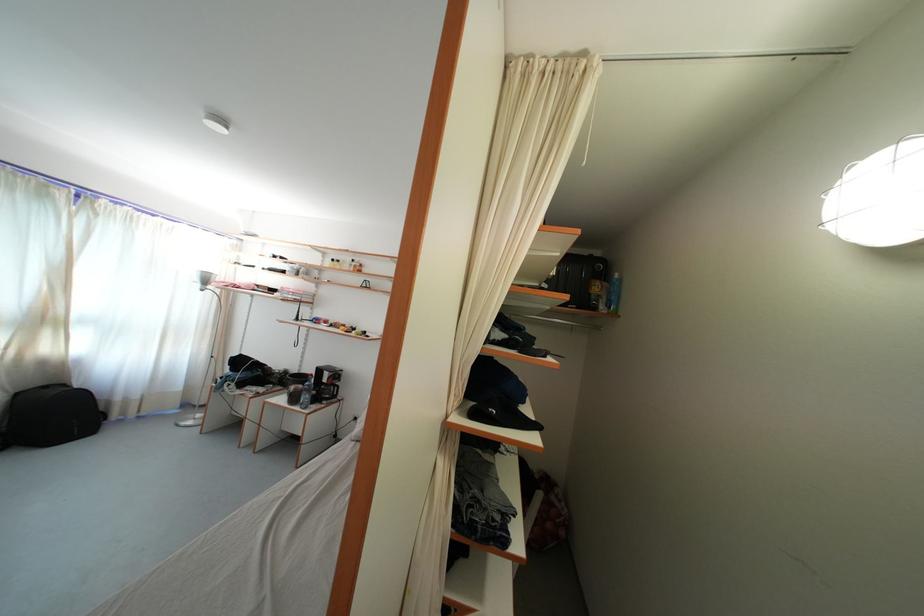
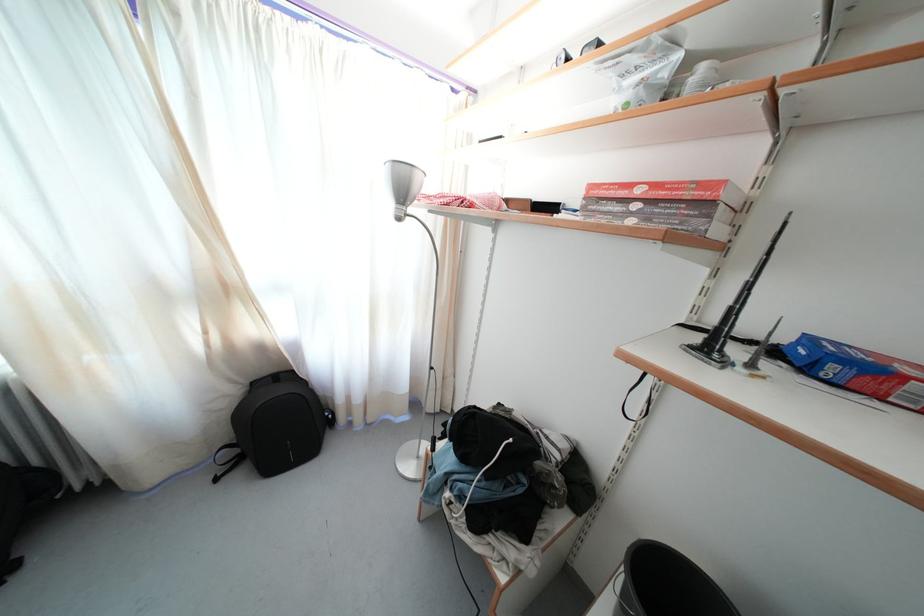
Where in the second image is the point corresponding to point 213,286 from the first image?

(408, 199)